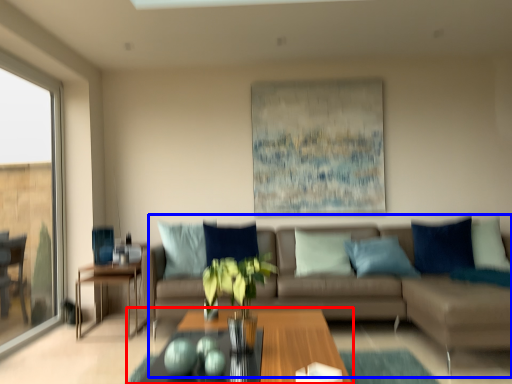
Question: Which of the following is the closest to the observer, coffee table (highlighted by a red box) or studio couch (highlighted by a blue box)?

Choices:
 (A) coffee table
 (B) studio couch

Answer: (A)